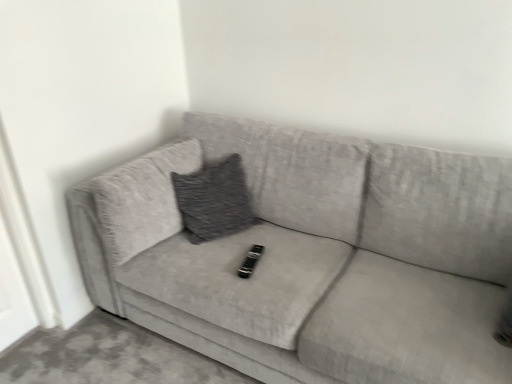
Question: Can you confirm if textured gray couch at center is thinner than black plastic remote at center?

Choices:
 (A) yes
 (B) no

Answer: (B)

Question: From a real-world perspective, is textured gray couch at center below black plastic remote at center?

Choices:
 (A) yes
 (B) no

Answer: (A)

Question: Does textured gray couch at center have a lesser height compared to black plastic remote at center?

Choices:
 (A) yes
 (B) no

Answer: (B)

Question: Is the position of textured gray couch at center more distant than that of black plastic remote at center?

Choices:
 (A) no
 (B) yes

Answer: (A)

Question: Is textured gray couch at center positioned with its back to black plastic remote at center?

Choices:
 (A) yes
 (B) no

Answer: (A)

Question: Is textured gray couch at center located outside black plastic remote at center?

Choices:
 (A) yes
 (B) no

Answer: (A)

Question: Can you confirm if black plastic remote at center is taller than textured gray couch at center?

Choices:
 (A) yes
 (B) no

Answer: (B)

Question: Is black plastic remote at center located outside textured gray couch at center?

Choices:
 (A) yes
 (B) no

Answer: (B)

Question: Does black plastic remote at center appear on the left side of textured gray couch at center?

Choices:
 (A) no
 (B) yes

Answer: (B)

Question: Is black plastic remote at center far away from textured gray couch at center?

Choices:
 (A) no
 (B) yes

Answer: (A)

Question: Is black plastic remote at center at the right side of textured gray couch at center?

Choices:
 (A) yes
 (B) no

Answer: (B)

Question: Is black plastic remote at center positioned with its back to textured gray couch at center?

Choices:
 (A) no
 (B) yes

Answer: (B)

Question: Does point (122, 301) appear closer or farther from the camera than point (260, 256)?

Choices:
 (A) farther
 (B) closer

Answer: (A)